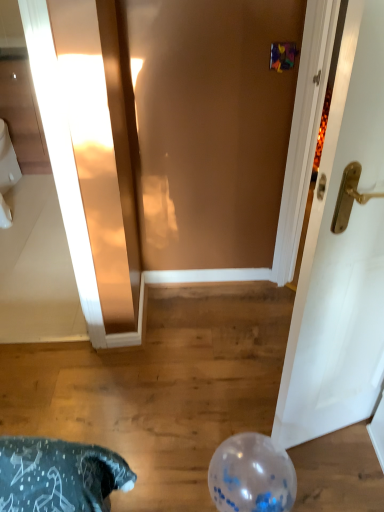
Measure the distance between white glossy toilet bowl at left and camera.

The depth of white glossy toilet bowl at left is 9.57 feet.

What is the approximate height of white glossy toilet bowl at left?

The height of white glossy toilet bowl at left is 18.33 inches.

What do you see at coordinates (7, 159) in the screenshot? This screenshot has width=384, height=512. I see `white glossy toilet bowl at left` at bounding box center [7, 159].

Identify the location of white glossy toilet bowl at left. (7, 159).

What are the coordinates of `transparent plastic balloon at lower center` in the screenshot? It's located at (251, 475).

Measure the distance between transparent plastic balloon at lower center and camera.

The depth of transparent plastic balloon at lower center is 4.04 feet.

Image resolution: width=384 pixels, height=512 pixels. What do you see at coordinates (251, 475) in the screenshot?
I see `transparent plastic balloon at lower center` at bounding box center [251, 475].

Locate an element on the screen. white glossy toilet bowl at left is located at coordinates (7, 159).

Considering the relative positions of white glossy toilet bowl at left and transparent plastic balloon at lower center in the image provided, is white glossy toilet bowl at left to the left of transparent plastic balloon at lower center from the viewer's perspective?

Yes.

Considering their positions, is white glossy toilet bowl at left located in front of or behind transparent plastic balloon at lower center?

white glossy toilet bowl at left is positioned farther from the viewer than transparent plastic balloon at lower center.

Does point (6, 165) lie in front of point (252, 447)?

That is False.

From the image's perspective, which object appears higher, white glossy toilet bowl at left or transparent plastic balloon at lower center?

white glossy toilet bowl at left.

From a real-world perspective, is white glossy toilet bowl at left positioned over transparent plastic balloon at lower center based on gravity?

Yes, from a real-world perspective, white glossy toilet bowl at left is on top of transparent plastic balloon at lower center.

Is white glossy toilet bowl at left thinner than transparent plastic balloon at lower center?

No.

Which of these two, white glossy toilet bowl at left or transparent plastic balloon at lower center, stands taller?

With more height is white glossy toilet bowl at left.

Based on their sizes in the image, would you say white glossy toilet bowl at left is bigger or smaller than transparent plastic balloon at lower center?

In the image, white glossy toilet bowl at left appears to be larger than transparent plastic balloon at lower center.

Is white glossy toilet bowl at left situated inside transparent plastic balloon at lower center or outside?

white glossy toilet bowl at left is outside transparent plastic balloon at lower center.

Is white glossy toilet bowl at left directly adjacent to transparent plastic balloon at lower center?

No, white glossy toilet bowl at left is not touching transparent plastic balloon at lower center.

Is white glossy toilet bowl at left oriented towards transparent plastic balloon at lower center?

No, white glossy toilet bowl at left is not facing towards transparent plastic balloon at lower center.

How many degrees apart are the facing directions of white glossy toilet bowl at left and transparent plastic balloon at lower center?

They differ by 90.2 degrees in their facing directions.

The width and height of the screenshot is (384, 512). Identify the location of toilet bowl above the transparent plastic balloon at lower center (from the image's perspective). (7, 159).

Which is more to the left, transparent plastic balloon at lower center or white glossy toilet bowl at left?

white glossy toilet bowl at left.

Is transparent plastic balloon at lower center positioned behind white glossy toilet bowl at left?

No, transparent plastic balloon at lower center is closer to the camera.

Is point (250, 440) closer or farther from the camera than point (8, 141)?

Point (250, 440) is closer to the camera than point (8, 141).

From the image's perspective, between transparent plastic balloon at lower center and white glossy toilet bowl at left, which one is located above?

white glossy toilet bowl at left.

From a real-world perspective, does transparent plastic balloon at lower center sit lower than white glossy toilet bowl at left?

Indeed, from a real-world perspective, transparent plastic balloon at lower center is positioned beneath white glossy toilet bowl at left.

Considering the relative sizes of transparent plastic balloon at lower center and white glossy toilet bowl at left in the image provided, is transparent plastic balloon at lower center wider than white glossy toilet bowl at left?

Incorrect, the width of transparent plastic balloon at lower center does not surpass that of white glossy toilet bowl at left.

Between transparent plastic balloon at lower center and white glossy toilet bowl at left, which one has more height?

white glossy toilet bowl at left is taller.

Between transparent plastic balloon at lower center and white glossy toilet bowl at left, which one has larger size?

Bigger between the two is white glossy toilet bowl at left.

Is transparent plastic balloon at lower center situated inside white glossy toilet bowl at left or outside?

transparent plastic balloon at lower center lies outside white glossy toilet bowl at left.

Is transparent plastic balloon at lower center far away from white glossy toilet bowl at left?

Yes, transparent plastic balloon at lower center and white glossy toilet bowl at left are located far from each other.

Is transparent plastic balloon at lower center looking in the opposite direction of white glossy toilet bowl at left?

Result: No, white glossy toilet bowl at left is not at the back of transparent plastic balloon at lower center.

How many degrees apart are the facing directions of transparent plastic balloon at lower center and white glossy toilet bowl at left?

The facing directions of transparent plastic balloon at lower center and white glossy toilet bowl at left are 90.2 degrees apart.

In the image, there is a transparent plastic balloon at lower center. Where is `toilet bowl above it (from the image's perspective)`? This screenshot has width=384, height=512. toilet bowl above it (from the image's perspective) is located at coordinates (7, 159).

I want to click on toilet bowl positioned vertically above the transparent plastic balloon at lower center (from a real-world perspective), so click(7, 159).

Where is `balloon located in front of the white glossy toilet bowl at left`? Image resolution: width=384 pixels, height=512 pixels. balloon located in front of the white glossy toilet bowl at left is located at coordinates (251, 475).